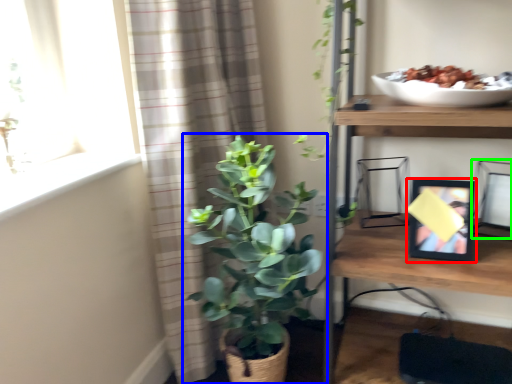
Question: Which is nearer to the picture frame (highlighted by a red box)? houseplant (highlighted by a blue box) or picture frame (highlighted by a green box).

Choices:
 (A) houseplant
 (B) picture frame

Answer: (B)